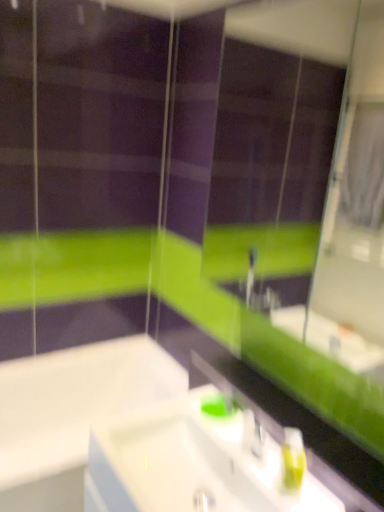
Question: Is green matte mirror at upper center thinner than white glossy sink at center?

Choices:
 (A) no
 (B) yes

Answer: (B)

Question: Is green matte mirror at upper center facing towards white glossy sink at center?

Choices:
 (A) no
 (B) yes

Answer: (A)

Question: From a real-world perspective, is green matte mirror at upper center beneath white glossy sink at center?

Choices:
 (A) yes
 (B) no

Answer: (B)

Question: Is green matte mirror at upper center turned away from white glossy sink at center?

Choices:
 (A) no
 (B) yes

Answer: (A)

Question: Does green matte mirror at upper center have a smaller size compared to white glossy sink at center?

Choices:
 (A) no
 (B) yes

Answer: (A)

Question: Considering the positions of white glossy bathtub at lower left and green matte mirror at upper center in the image, is white glossy bathtub at lower left wider or thinner than green matte mirror at upper center?

Choices:
 (A) thin
 (B) wide

Answer: (B)

Question: Does point tap(52, 483) appear closer or farther from the camera than point tap(266, 110)?

Choices:
 (A) closer
 (B) farther

Answer: (A)

Question: Is white glossy bathtub at lower left taller or shorter than green matte mirror at upper center?

Choices:
 (A) tall
 (B) short

Answer: (B)

Question: From a real-world perspective, is white glossy bathtub at lower left above or below green matte mirror at upper center?

Choices:
 (A) below
 (B) above

Answer: (A)

Question: From a real-world perspective, is white glossy bathtub at lower left above or below green matte soap dispenser at lower right?

Choices:
 (A) below
 (B) above

Answer: (A)

Question: Looking at the image, does white glossy bathtub at lower left seem bigger or smaller compared to green matte soap dispenser at lower right?

Choices:
 (A) big
 (B) small

Answer: (A)

Question: From their relative heights in the image, would you say white glossy bathtub at lower left is taller or shorter than green matte soap dispenser at lower right?

Choices:
 (A) tall
 (B) short

Answer: (A)

Question: Considering their positions, is white glossy bathtub at lower left located in front of or behind green matte soap dispenser at lower right?

Choices:
 (A) behind
 (B) front

Answer: (A)

Question: From the image's perspective, is white glossy sink at center located above or below green matte mirror at upper center?

Choices:
 (A) above
 (B) below

Answer: (B)

Question: From a real-world perspective, is white glossy sink at center above or below green matte mirror at upper center?

Choices:
 (A) above
 (B) below

Answer: (B)